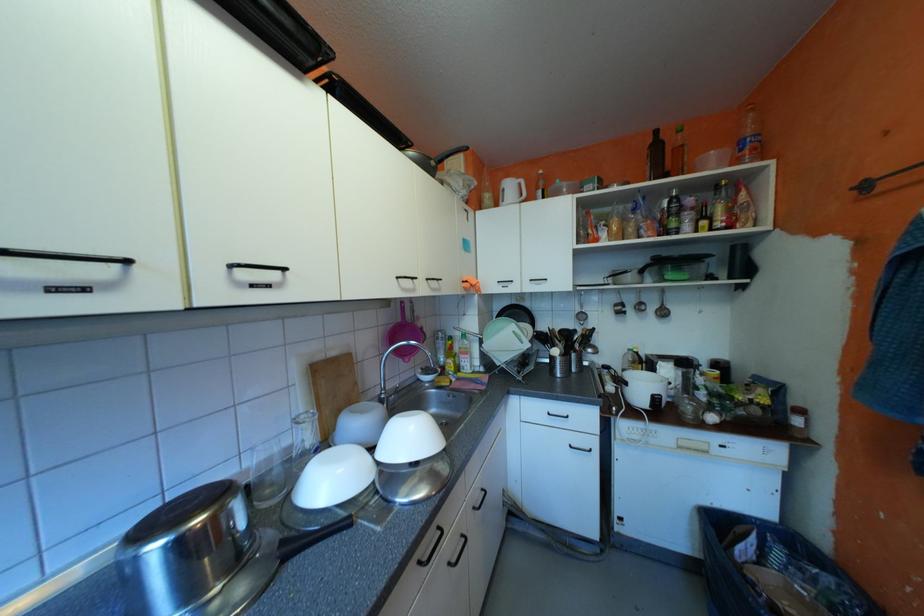
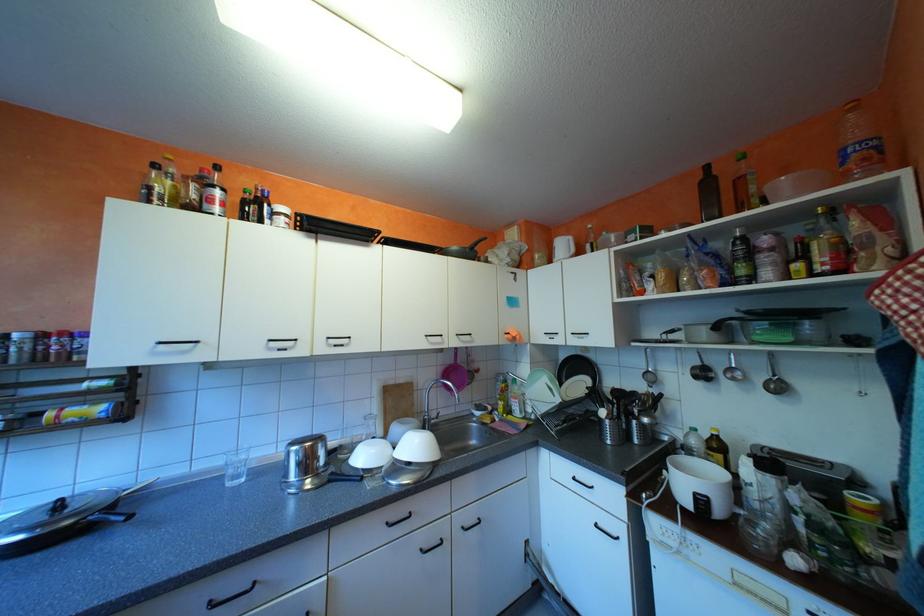
Locate, in the second image, the point that corresponds to point 485,507 in the first image.

(475, 527)